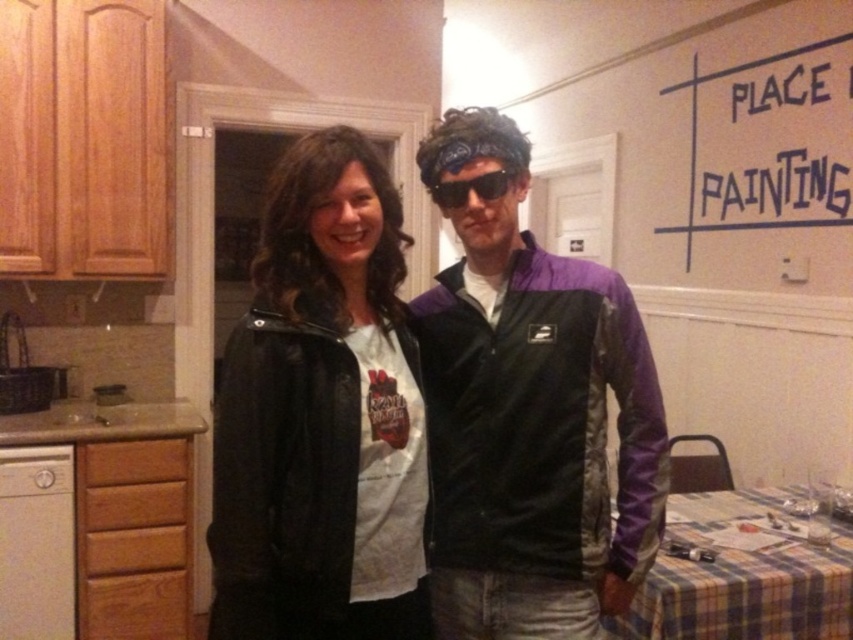
You are trying to decide which item to grab first, the matte black jacket at center or the sunglasses at center. Based on their sizes, which one do you think is easier to reach?

The matte black jacket at center is larger in size than the sunglasses at center, so it is easier to reach.

You are standing in the kitchen and want to reach both the point at coordinates (436, 428) and the point at coordinates (509, 172). Which point should you move towards first to reach the closer one?

You should move towards point (436, 428) first because it is closer to you than point (509, 172), which is further away.